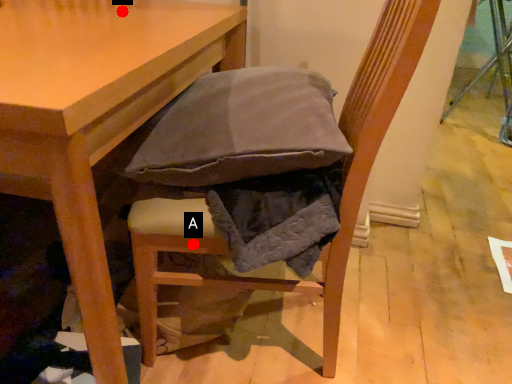
Question: Two points are circled on the image, labeled by A and B beside each circle. Which of the following is the farthest from the observer?

Choices:
 (A) A is further
 (B) B is further

Answer: (B)